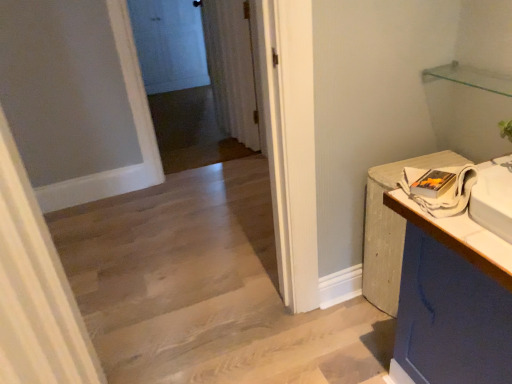
Where is `white textured curtain at left, which appears as the 1th curtain when ordered from the bottom`? white textured curtain at left, which appears as the 1th curtain when ordered from the bottom is located at coordinates (35, 290).

The width and height of the screenshot is (512, 384). What do you see at coordinates (35, 290) in the screenshot?
I see `white textured curtain at left, the first curtain when ordered from front to back` at bounding box center [35, 290].

The image size is (512, 384). What do you see at coordinates (232, 68) in the screenshot? I see `white sheer curtain at center, the 1th curtain viewed from the back` at bounding box center [232, 68].

What are the coordinates of `white wood counter at right` in the screenshot? It's located at [433, 287].

Considering the relative sizes of white glossy door at upper center and white textured curtain at left, which appears as the 1th curtain when ordered from the bottom, in the image provided, is white glossy door at upper center wider than white textured curtain at left, which appears as the 1th curtain when ordered from the bottom,?

Incorrect, the width of white glossy door at upper center does not surpass that of white textured curtain at left, which appears as the 1th curtain when ordered from the bottom.

From the image's perspective, is white glossy door at upper center above or below white textured curtain at left, the first curtain when ordered from front to back?

white glossy door at upper center is above white textured curtain at left, the first curtain when ordered from front to back.

Between white glossy door at upper center and white textured curtain at left, the first curtain when ordered from front to back, which one appears on the left side from the viewer's perspective?

Positioned to the left is white glossy door at upper center.

Who is bigger, white glossy door at upper center or white textured curtain at left, acting as the second curtain starting from the top?

Bigger between the two is white textured curtain at left, acting as the second curtain starting from the top.

This screenshot has height=384, width=512. In order to click on curtain below the white wood counter at right (from the image's perspective) in this screenshot , I will do `click(35, 290)`.

Considering the positions of objects white wood counter at right and white textured curtain at left, the first curtain when ordered from front to back, in the image provided, who is behind, white wood counter at right or white textured curtain at left, the first curtain when ordered from front to back,?

Positioned behind is white wood counter at right.

Is white wood counter at right positioned beyond the bounds of white textured curtain at left, acting as the second curtain starting from the top?

white wood counter at right lies outside white textured curtain at left, acting as the second curtain starting from the top,'s area.

Would you say white wood counter at right is a long distance from white textured curtain at left, the first curtain when ordered from front to back?

That's not correct — white wood counter at right is a little close to white textured curtain at left, the first curtain when ordered from front to back.

Considering the positions of point (152, 72) and point (436, 247), is point (152, 72) closer or farther from the camera than point (436, 247)?

Point (152, 72).

Is white glossy door at upper center not near white wood counter at right?

That's right, there is a large distance between white glossy door at upper center and white wood counter at right.

I want to click on counter that appears below the white glossy door at upper center (from a real-world perspective), so click(x=433, y=287).

Is white textured curtain at left, which is the second curtain from back to front, far from white glossy door at upper center?

white textured curtain at left, which is the second curtain from back to front, is far away from white glossy door at upper center.

From a real-world perspective, is white textured curtain at left, acting as the second curtain starting from the top, physically above white glossy door at upper center?

Yes, from a real-world perspective, white textured curtain at left, acting as the second curtain starting from the top, is on top of white glossy door at upper center.

What's the angular difference between white textured curtain at left, acting as the second curtain starting from the top, and white glossy door at upper center's facing directions?

The angular difference between white textured curtain at left, acting as the second curtain starting from the top, and white glossy door at upper center is 83.7 degrees.

Is white textured curtain at left, the first curtain when ordered from front to back, aimed at white glossy door at upper center?

No, white textured curtain at left, the first curtain when ordered from front to back, does not turn towards white glossy door at upper center.

Can we say white sheer curtain at center, the 1th curtain viewed from the back, lies outside white textured curtain at left, the first curtain when ordered from front to back?

That's correct, white sheer curtain at center, the 1th curtain viewed from the back, is outside of white textured curtain at left, the first curtain when ordered from front to back.

From a real-world perspective, which is physically above, white sheer curtain at center, the 2th curtain from the bottom, or white textured curtain at left, which appears as the 1th curtain when ordered from the bottom?

white textured curtain at left, which appears as the 1th curtain when ordered from the bottom, is physically above.

Who is smaller, white sheer curtain at center, the 2th curtain in the front-to-back sequence, or white textured curtain at left, the first curtain when ordered from front to back?

With smaller size is white sheer curtain at center, the 2th curtain in the front-to-back sequence.

Does white wood counter at right turn towards white sheer curtain at center, the 2th curtain from the bottom?

No, white wood counter at right is not turned towards white sheer curtain at center, the 2th curtain from the bottom.

Looking at this image, is there a large distance between white wood counter at right and white sheer curtain at center, the 1th curtain viewed from the back?

white wood counter at right is far away from white sheer curtain at center, the 1th curtain viewed from the back.

Is white wood counter at right at the left side of white sheer curtain at center, positioned as the first curtain in top-to-bottom order?

Incorrect, white wood counter at right is not on the left side of white sheer curtain at center, positioned as the first curtain in top-to-bottom order.

From the image's perspective, which is above, white wood counter at right or white sheer curtain at center, positioned as the first curtain in top-to-bottom order?

white sheer curtain at center, positioned as the first curtain in top-to-bottom order, from the image's perspective.

The height and width of the screenshot is (384, 512). Find the location of `curtain that appears above the white textured curtain at left, acting as the second curtain starting from the top (from the image's perspective)`. curtain that appears above the white textured curtain at left, acting as the second curtain starting from the top (from the image's perspective) is located at coordinates (232, 68).

Which of these two, white textured curtain at left, which appears as the 1th curtain when ordered from the bottom, or white sheer curtain at center, positioned as the first curtain in top-to-bottom order, stands shorter?

Standing shorter between the two is white sheer curtain at center, positioned as the first curtain in top-to-bottom order.

Can you confirm if white textured curtain at left, acting as the second curtain starting from the top, is positioned to the right of white sheer curtain at center, the 1th curtain viewed from the back?

In fact, white textured curtain at left, acting as the second curtain starting from the top, is to the left of white sheer curtain at center, the 1th curtain viewed from the back.

Does white textured curtain at left, the first curtain when ordered from front to back, have a greater width compared to white sheer curtain at center, positioned as the first curtain in top-to-bottom order?

Yes.

The height and width of the screenshot is (384, 512). There is a white glossy door at upper center. What are the coordinates of `the 2nd curtain above it (from a real-world perspective)` in the screenshot? It's located at (35, 290).

Locate an element on the screen. curtain below the white wood counter at right (from the image's perspective) is located at coordinates (35, 290).

Considering their positions, is white wood counter at right positioned closer to white glossy door at upper center than white sheer curtain at center, the 2th curtain in the front-to-back sequence?

Among the two, white sheer curtain at center, the 2th curtain in the front-to-back sequence, is located nearer to white glossy door at upper center.

From the image, which object appears to be farther from white sheer curtain at center, the 2th curtain in the front-to-back sequence, white textured curtain at left, acting as the second curtain starting from the top, or white wood counter at right?

The object further to white sheer curtain at center, the 2th curtain in the front-to-back sequence, is white textured curtain at left, acting as the second curtain starting from the top.

From the image, which object appears to be farther from white sheer curtain at center, positioned as the first curtain in top-to-bottom order, white wood counter at right or white glossy door at upper center?

Among the two, white glossy door at upper center is located further to white sheer curtain at center, positioned as the first curtain in top-to-bottom order.

From the picture: When comparing their distances from white textured curtain at left, the first curtain when ordered from front to back, does white wood counter at right or white glossy door at upper center seem further?

white glossy door at upper center lies further to white textured curtain at left, the first curtain when ordered from front to back, than the other object.

From the image, which object appears to be farther from white sheer curtain at center, the 2th curtain in the front-to-back sequence, white wood counter at right or white textured curtain at left, which is the second curtain from back to front?

white textured curtain at left, which is the second curtain from back to front, lies further to white sheer curtain at center, the 2th curtain in the front-to-back sequence, than the other object.

Considering their positions, is white textured curtain at left, which appears as the 1th curtain when ordered from the bottom, positioned further to white wood counter at right than white sheer curtain at center, the 2th curtain in the front-to-back sequence?

white sheer curtain at center, the 2th curtain in the front-to-back sequence, is positioned further to the anchor white wood counter at right.

Estimate the real-world distances between objects in this image. Which object is further from white wood counter at right, white textured curtain at left, the first curtain when ordered from front to back, or white glossy door at upper center?

white glossy door at upper center.

Considering their positions, is white sheer curtain at center, positioned as the first curtain in top-to-bottom order, positioned further to white glossy door at upper center than white textured curtain at left, which appears as the 1th curtain when ordered from the bottom?

white textured curtain at left, which appears as the 1th curtain when ordered from the bottom, lies further to white glossy door at upper center than the other object.

Locate an element on the screen. counter between white textured curtain at left, acting as the second curtain starting from the top, and white glossy door at upper center, along the z-axis is located at coordinates (433, 287).

The height and width of the screenshot is (384, 512). I want to click on curtain between white textured curtain at left, the first curtain when ordered from front to back, and white glossy door at upper center from front to back, so click(232, 68).

You are a GUI agent. You are given a task and a screenshot of the screen. Output one action in this format:
    pyautogui.click(x=<x>, y=<y>)
    Task: Click on the counter between white textured curtain at left, acting as the second curtain starting from the top, and white sheer curtain at center, the 2th curtain from the bottom, in the front-back direction
    
    Given the screenshot: What is the action you would take?
    pyautogui.click(x=433, y=287)

Identify the location of curtain between white wood counter at right and white glossy door at upper center from front to back. The height and width of the screenshot is (384, 512). (232, 68).